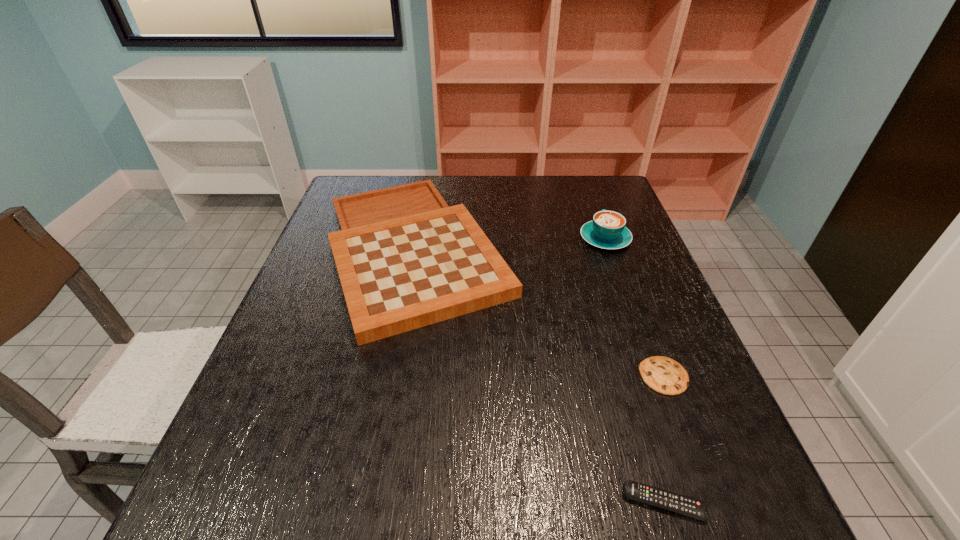
This screenshot has height=540, width=960. What are the coordinates of `free region at the left edge of the desktop` in the screenshot? It's located at (239, 433).

Where is `vacant point at the right edge`? This screenshot has height=540, width=960. vacant point at the right edge is located at coordinates (636, 333).

Locate an element on the screen. vacant space at the far left corner of the desktop is located at coordinates (364, 178).

In the image, there is a desktop. Identify the location of free space at the far right corner. The width and height of the screenshot is (960, 540). (592, 192).

At what (x,y) coordinates should I click in order to perform the action: click on vacant space that's between the nearest object and the tallest object. Please return your answer as a coordinate pair (x, y). This screenshot has width=960, height=540. Looking at the image, I should click on (635, 371).

The height and width of the screenshot is (540, 960). Identify the location of vacant space that is in between the leftmost object and the cookie. (540, 313).

Image resolution: width=960 pixels, height=540 pixels. I want to click on blank region between the leftmost object and the cappuccino, so click(x=510, y=245).

Locate an element on the screen. Image resolution: width=960 pixels, height=540 pixels. empty location between the cookie and the nearest object is located at coordinates (663, 440).

In order to click on vacant point located between the nearest object and the leftmost object in this screenshot , I will do `click(540, 376)`.

The height and width of the screenshot is (540, 960). I want to click on vacant region between the second tallest object and the cookie, so click(540, 313).